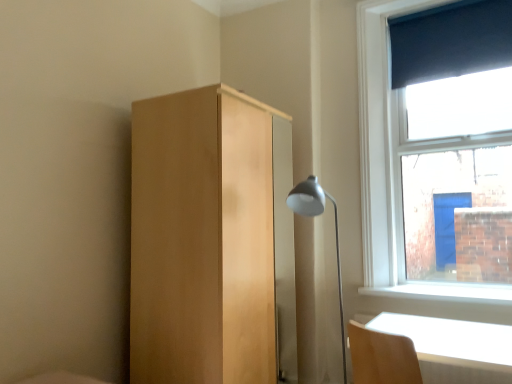
Describe the element at coordinates (211, 240) in the screenshot. I see `light wood dresser at center` at that location.

The image size is (512, 384). Describe the element at coordinates (454, 347) in the screenshot. I see `light wood table at lower right` at that location.

Find the location of a particular element. dark blue fabric at upper right is located at coordinates (450, 41).

This screenshot has height=384, width=512. Find the location of `light wood dresser at center`. light wood dresser at center is located at coordinates (211, 240).

Between light wood table at lower right and light wood dresser at center, which one is positioned in front?

Positioned in front is light wood table at lower right.

Does light wood table at lower right have a greater width compared to light wood dresser at center?

No, light wood table at lower right is not wider than light wood dresser at center.

From the picture: From a real-world perspective, which is physically below, light wood table at lower right or light wood dresser at center?

light wood table at lower right.

Considering the relative positions of light wood table at lower right and light wood dresser at center in the image provided, is light wood table at lower right to the left of light wood dresser at center from the viewer's perspective?

No, light wood table at lower right is not to the left of light wood dresser at center.

Does light wood table at lower right have a lesser height compared to matte silver lamp at center-right?

Yes, light wood table at lower right is shorter than matte silver lamp at center-right.

Are light wood table at lower right and matte silver lamp at center-right located far from each other?

light wood table at lower right is near matte silver lamp at center-right, not far away.

You are a GUI agent. You are given a task and a screenshot of the screen. Output one action in this format:
    pyautogui.click(x=<x>, y=<y>)
    Task: Click on the lamp on the left of light wood table at lower right
    The height and width of the screenshot is (384, 512).
    Given the screenshot: What is the action you would take?
    pyautogui.click(x=314, y=216)

Between point (490, 324) and point (338, 238), which one is positioned behind?

Positioned behind is point (338, 238).

Locate an element on the screen. The height and width of the screenshot is (384, 512). lamp to the right of light wood dresser at center is located at coordinates (314, 216).

In the scene shown: Is light wood dresser at center inside or outside of matte silver lamp at center-right?

light wood dresser at center exists outside the volume of matte silver lamp at center-right.

From a real-world perspective, which is physically above, light wood dresser at center or matte silver lamp at center-right?

From a 3D spatial view, light wood dresser at center is above.

Would you say dark blue fabric at upper right is a long distance from matte silver lamp at center-right?

Indeed, dark blue fabric at upper right is not near matte silver lamp at center-right.

Identify the location of lamp in front of the dark blue fabric at upper right. This screenshot has height=384, width=512. (314, 216).

Would you say dark blue fabric at upper right is outside matte silver lamp at center-right?

Yes, dark blue fabric at upper right is located beyond the bounds of matte silver lamp at center-right.

Considering the relative sizes of light wood table at lower right and dark blue fabric at upper right in the image provided, is light wood table at lower right thinner than dark blue fabric at upper right?

In fact, light wood table at lower right might be wider than dark blue fabric at upper right.

In the scene shown: From the image's perspective, relative to dark blue fabric at upper right, is light wood table at lower right above or below?

Clearly, from the image's perspective, light wood table at lower right is below dark blue fabric at upper right.

Find the location of a particular element. Image resolution: width=512 pixels, height=384 pixels. curtain that appears on the right of light wood table at lower right is located at coordinates (450, 41).

Does light wood table at lower right contain dark blue fabric at upper right?

No, light wood table at lower right does not contain dark blue fabric at upper right.

In the image, there is a light wood table at lower right. At what (x,y) coordinates should I click in order to perform the action: click on curtain above it (from the image's perspective). Please return your answer as a coordinate pair (x, y). Looking at the image, I should click on (450, 41).

Is dark blue fabric at upper right aimed at light wood table at lower right?

No, dark blue fabric at upper right is not facing towards light wood table at lower right.

Is dark blue fabric at upper right positioned beyond the bounds of light wood table at lower right?

Indeed, dark blue fabric at upper right is completely outside light wood table at lower right.

Which object is positioned more to the left, light wood dresser at center or light wood table at lower right?

From the viewer's perspective, light wood dresser at center appears more on the left side.

Between light wood dresser at center and light wood table at lower right, which one has larger width?

light wood dresser at center is wider.

Can you confirm if light wood dresser at center is bigger than light wood table at lower right?

Yes.

The height and width of the screenshot is (384, 512). In order to click on dresser located behind the light wood table at lower right in this screenshot , I will do `click(211, 240)`.

Locate an element on the screen. dresser on the left of light wood table at lower right is located at coordinates (211, 240).

Image resolution: width=512 pixels, height=384 pixels. What are the coordinates of `table below the matte silver lamp at center-right (from a real-world perspective)` in the screenshot? It's located at (454, 347).

Looking at the image, which one is located closer to dark blue fabric at upper right, matte silver lamp at center-right or light wood dresser at center?

matte silver lamp at center-right is closer to dark blue fabric at upper right.

From the image, which object appears to be farther from matte silver lamp at center-right, light wood dresser at center or light wood table at lower right?

The object further to matte silver lamp at center-right is light wood table at lower right.

Which object lies nearer to the anchor point light wood dresser at center, dark blue fabric at upper right or light wood table at lower right?

Among the two, light wood table at lower right is located nearer to light wood dresser at center.

Which object lies further to the anchor point dark blue fabric at upper right, matte silver lamp at center-right or light wood table at lower right?

light wood table at lower right.

Looking at the image, which one is located further to dark blue fabric at upper right, light wood dresser at center or matte silver lamp at center-right?

light wood dresser at center.

Looking at the image, which one is located closer to light wood dresser at center, matte silver lamp at center-right or dark blue fabric at upper right?

matte silver lamp at center-right is closer to light wood dresser at center.

From the picture: Estimate the real-world distances between objects in this image. Which object is closer to light wood table at lower right, light wood dresser at center or matte silver lamp at center-right?

matte silver lamp at center-right lies closer to light wood table at lower right than the other object.

Considering their positions, is dark blue fabric at upper right positioned further to light wood table at lower right than matte silver lamp at center-right?

dark blue fabric at upper right.

This screenshot has width=512, height=384. I want to click on lamp that lies between dark blue fabric at upper right and light wood table at lower right from top to bottom, so click(314, 216).

Where is `lamp between light wood dresser at center and light wood table at lower right in the horizontal direction`? lamp between light wood dresser at center and light wood table at lower right in the horizontal direction is located at coordinates (x=314, y=216).

You are a GUI agent. You are given a task and a screenshot of the screen. Output one action in this format:
    pyautogui.click(x=<x>, y=<y>)
    Task: Click on the dresser between dark blue fabric at upper right and light wood table at lower right in the up-down direction
    This screenshot has height=384, width=512.
    Given the screenshot: What is the action you would take?
    pyautogui.click(x=211, y=240)

This screenshot has width=512, height=384. I want to click on dresser between dark blue fabric at upper right and matte silver lamp at center-right in the vertical direction, so click(211, 240).